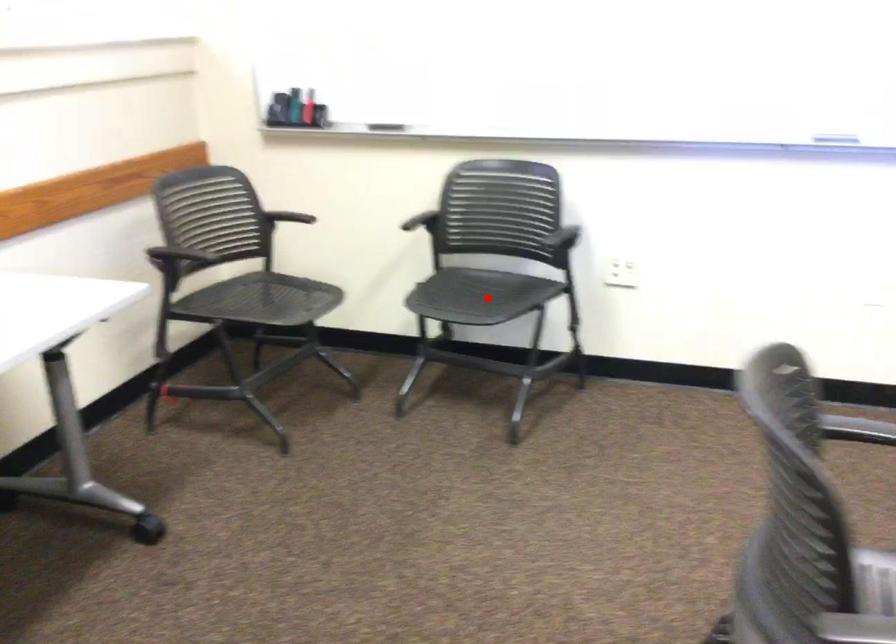
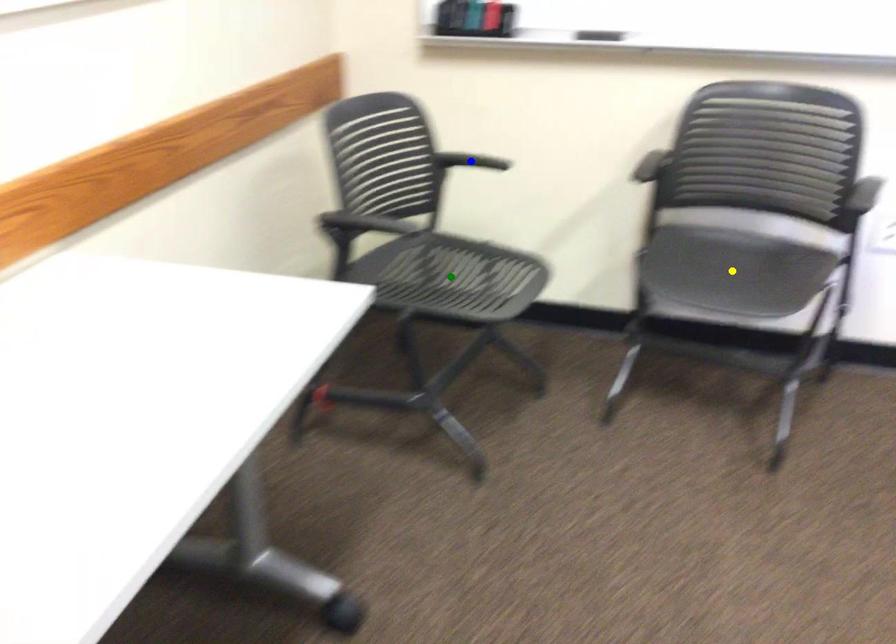
Question: I am providing you with two images of the same scene from different viewpoints. A red point is marked on the first image. You are given multiple points on the second image. Which point in image 2 is actually the same real-world point as the red point in image 1?

Choices:
 (A) blue point
 (B) green point
 (C) yellow point

Answer: (C)